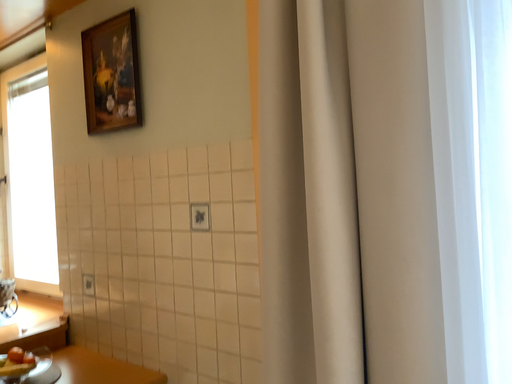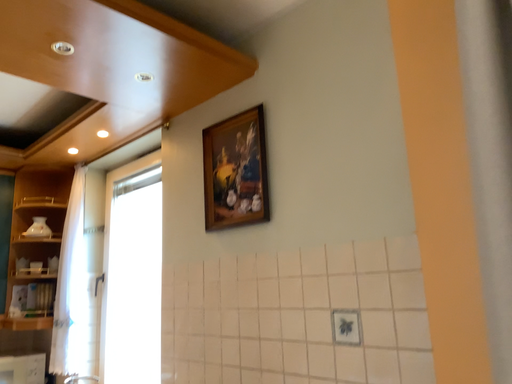
Question: How did the camera likely rotate when shooting the video?

Choices:
 (A) rotated upward
 (B) rotated downward

Answer: (A)